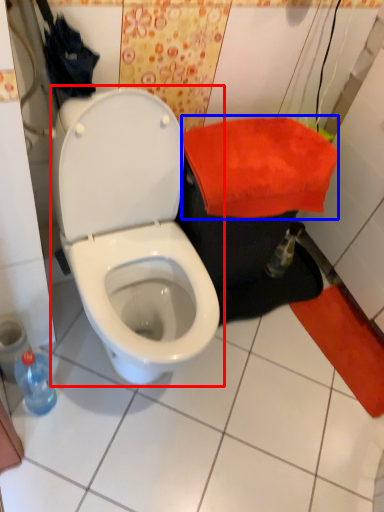
Question: Which object appears farthest to the camera in this image, toilet (highlighted by a red box) or beach towel (highlighted by a blue box)?

Choices:
 (A) toilet
 (B) beach towel

Answer: (B)